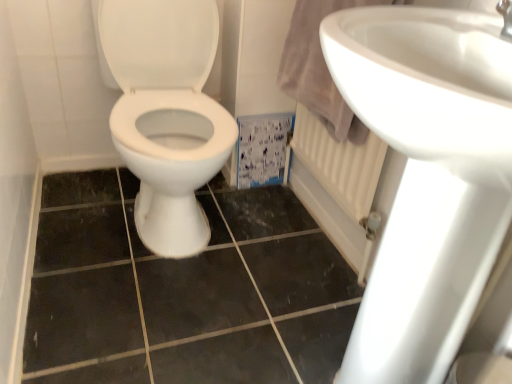
The image size is (512, 384). Describe the element at coordinates (426, 177) in the screenshot. I see `white glossy sink at upper right` at that location.

The image size is (512, 384). What are the coordinates of `white glossy sink at upper right` in the screenshot? It's located at (426, 177).

In order to face white glossy sink at upper right, should I rotate leftwards or rightwards?

It's best to rotate right around 20.010 degrees.

This screenshot has width=512, height=384. What do you see at coordinates (183, 291) in the screenshot?
I see `black ceramic tile at center` at bounding box center [183, 291].

At what (x,y) coordinates should I click in order to perform the action: click on black ceramic tile at center. Please return your answer as a coordinate pair (x, y). The image size is (512, 384). Looking at the image, I should click on (183, 291).

The width and height of the screenshot is (512, 384). Identify the location of white glossy sink at upper right. (426, 177).

Which is more to the right, white glossy sink at upper right or black ceramic tile at center?

From the viewer's perspective, white glossy sink at upper right appears more on the right side.

Does white glossy sink at upper right come in front of black ceramic tile at center?

Yes, the depth of white glossy sink at upper right is less than that of black ceramic tile at center.

Which is behind, point (387, 126) or point (279, 359)?

The point (279, 359) is behind.

Based on the photo, from the image's perspective, is white glossy sink at upper right above or below black ceramic tile at center?

Clearly, from the image's perspective, white glossy sink at upper right is above black ceramic tile at center.

From a real-world perspective, does white glossy sink at upper right stand above black ceramic tile at center?

Indeed, from a real-world perspective, white glossy sink at upper right stands above black ceramic tile at center.

Which of these two, white glossy sink at upper right or black ceramic tile at center, is wider?

Wider between the two is black ceramic tile at center.

From their relative heights in the image, would you say white glossy sink at upper right is taller or shorter than black ceramic tile at center?

white glossy sink at upper right is taller than black ceramic tile at center.

Considering the relative sizes of white glossy sink at upper right and black ceramic tile at center in the image provided, is white glossy sink at upper right smaller than black ceramic tile at center?

No, white glossy sink at upper right is not smaller than black ceramic tile at center.

Is white glossy sink at upper right inside the boundaries of black ceramic tile at center, or outside?

The correct answer is: outside.

Is there a large distance between white glossy sink at upper right and black ceramic tile at center?

No, white glossy sink at upper right is not far from black ceramic tile at center.

Is white glossy sink at upper right positioned with its back to black ceramic tile at center?

No, white glossy sink at upper right is not facing away from black ceramic tile at center.

How different are the orientations of white glossy sink at upper right and black ceramic tile at center in degrees?

There is a 1.3-degree angle between the facing directions of white glossy sink at upper right and black ceramic tile at center.

This screenshot has height=384, width=512. Identify the location of ceramic tile on the left of white glossy sink at upper right. (183, 291).

Is black ceramic tile at center at the left side of white glossy sink at upper right?

Yes, black ceramic tile at center is to the left of white glossy sink at upper right.

Considering their positions, is black ceramic tile at center located in front of or behind white glossy sink at upper right?

black ceramic tile at center is behind white glossy sink at upper right.

Considering the points (122, 343) and (459, 39), which point is in front, point (122, 343) or point (459, 39)?

Point (459, 39)

From the image's perspective, is black ceramic tile at center beneath white glossy sink at upper right?

Yes, from the image's perspective, black ceramic tile at center is beneath white glossy sink at upper right.

From a real-world perspective, is black ceramic tile at center located beneath white glossy sink at upper right?

Yes, from a real-world perspective, black ceramic tile at center is under white glossy sink at upper right.

Consider the image. Considering the relative sizes of black ceramic tile at center and white glossy sink at upper right in the image provided, is black ceramic tile at center thinner than white glossy sink at upper right?

Incorrect, the width of black ceramic tile at center is not less than that of white glossy sink at upper right.

Considering the relative sizes of black ceramic tile at center and white glossy sink at upper right in the image provided, is black ceramic tile at center taller than white glossy sink at upper right?

In fact, black ceramic tile at center may be shorter than white glossy sink at upper right.

Considering the sizes of objects black ceramic tile at center and white glossy sink at upper right in the image provided, who is smaller, black ceramic tile at center or white glossy sink at upper right?

black ceramic tile at center.

Is black ceramic tile at center positioned beyond the bounds of white glossy sink at upper right?

Yes, black ceramic tile at center is located beyond the bounds of white glossy sink at upper right.

Would you consider black ceramic tile at center to be distant from white glossy sink at upper right?

No, black ceramic tile at center is in close proximity to white glossy sink at upper right.

Is black ceramic tile at center oriented away from white glossy sink at upper right?

black ceramic tile at center does not have its back to white glossy sink at upper right.

Where is `ceramic tile behind the white glossy sink at upper right`? This screenshot has height=384, width=512. ceramic tile behind the white glossy sink at upper right is located at coordinates (183, 291).

The image size is (512, 384). I want to click on ceramic tile on the left of white glossy sink at upper right, so click(x=183, y=291).

Where is `sink in front of the black ceramic tile at center`? Image resolution: width=512 pixels, height=384 pixels. sink in front of the black ceramic tile at center is located at coordinates (426, 177).